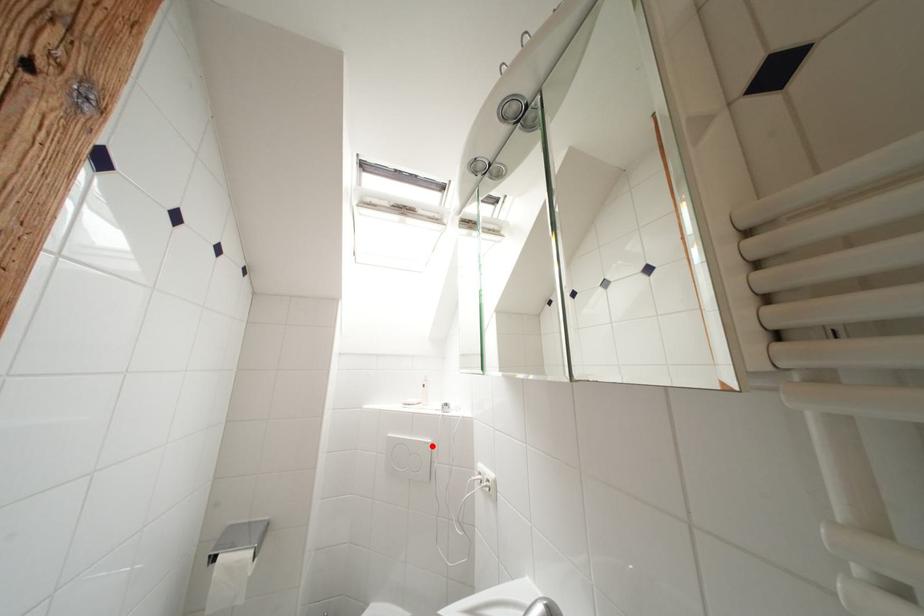
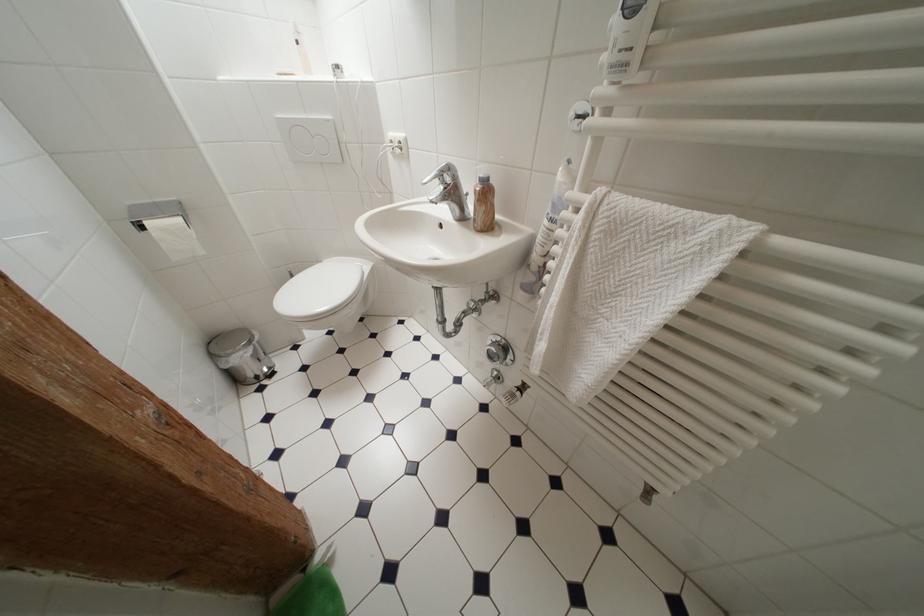
In the second image, find the point that corresponds to the highlighted location in the first image.

(333, 124)